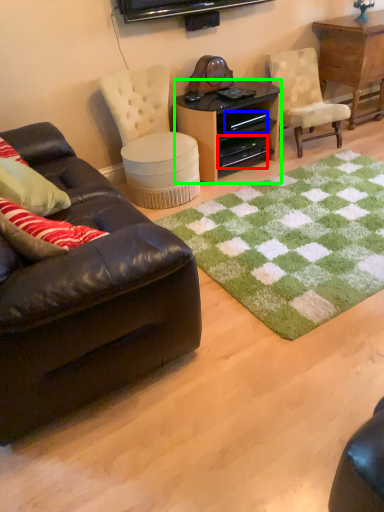
Question: Which is nearer to the drawer (highlighted by a red box)? drawer (highlighted by a blue box) or desk (highlighted by a green box).

Choices:
 (A) drawer
 (B) desk

Answer: (B)